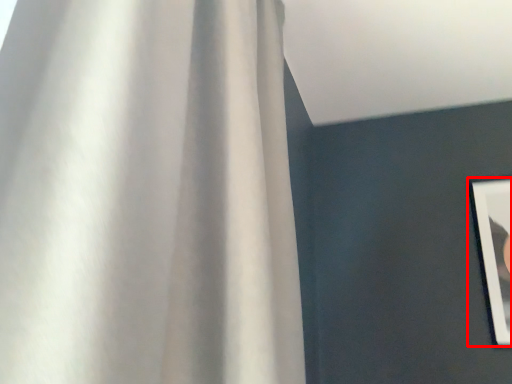
Question: Where is picture frame (annotated by the red box) located in relation to curtain in the image?

Choices:
 (A) right
 (B) left

Answer: (A)